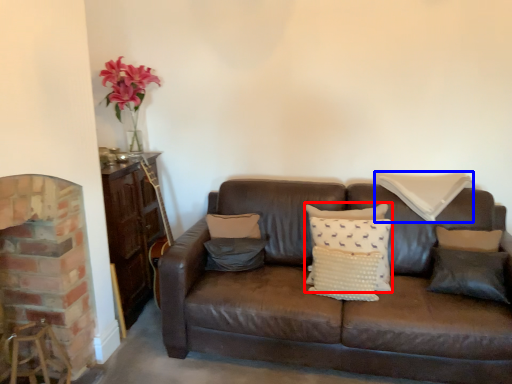
Question: Among these objects, which one is farthest to the camera, pillow (highlighted by a red box) or pillow (highlighted by a blue box)?

Choices:
 (A) pillow
 (B) pillow

Answer: (B)